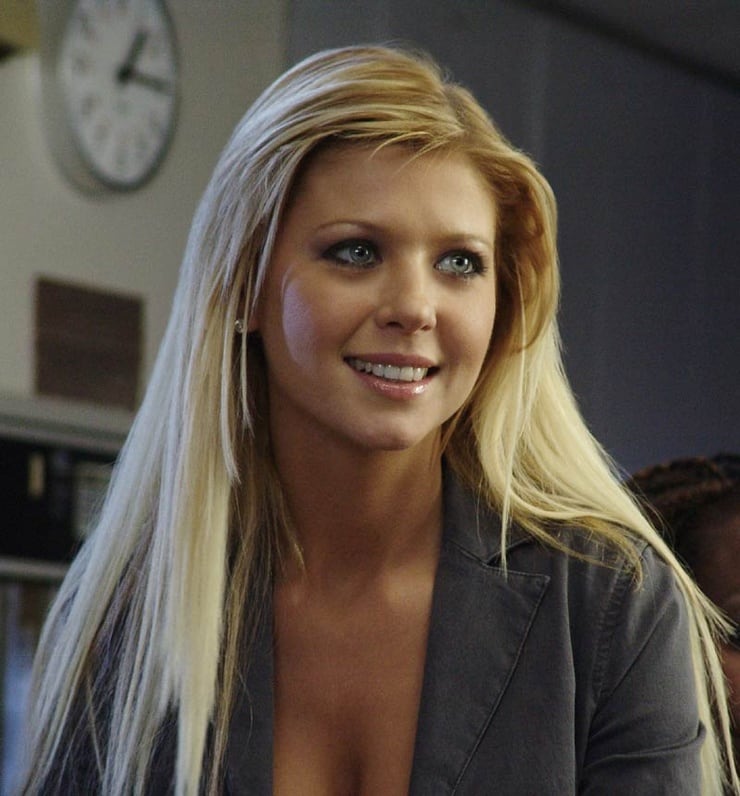
Where is `clock hands`? clock hands is located at coordinates (127, 53), (152, 77).